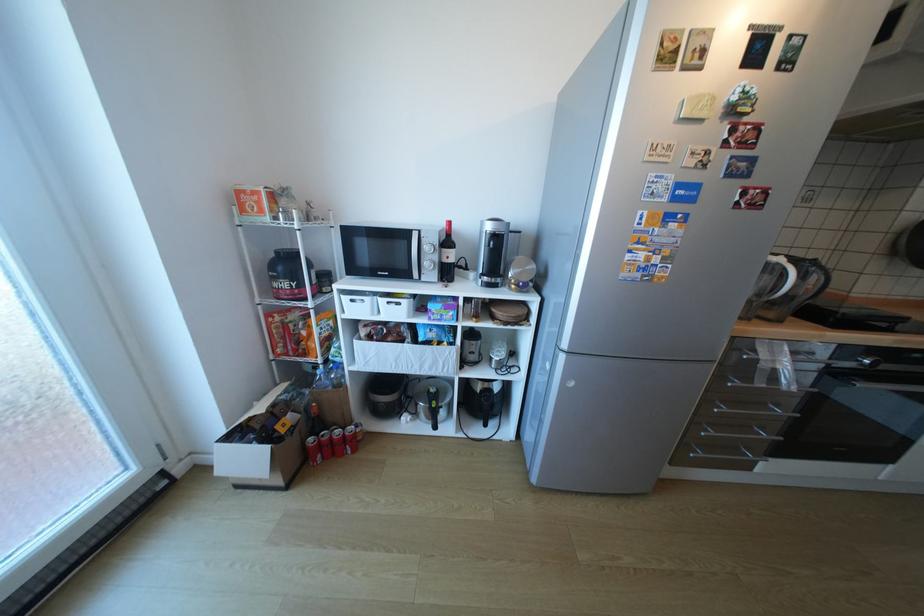
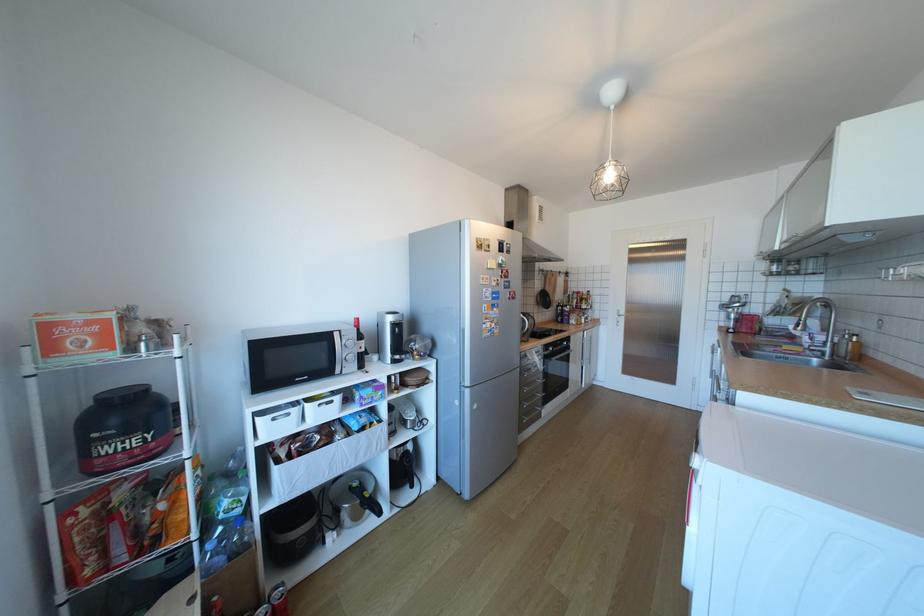
In the second image, find the point that corresponds to point (261, 209) in the first image.

(91, 346)